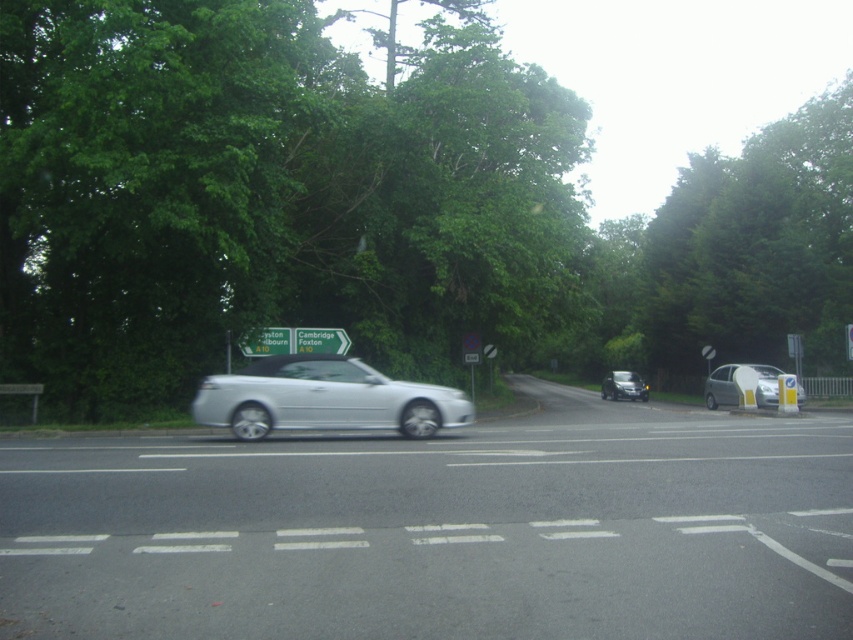
Looking at this image, you are a pedestrian standing at the side of the road. You see the silver metallic car at center and the green plastic sign at center. Which object is taller?

The green plastic sign at center is taller than the silver metallic car at center.

You are driving a car and see the green leafy tree at center and the green plastic signpost at upper center ahead on the road. Which object is closer to the road?

The green plastic signpost at upper center is closer to the road because the green leafy tree at center is positioned over it, meaning the tree is further away.